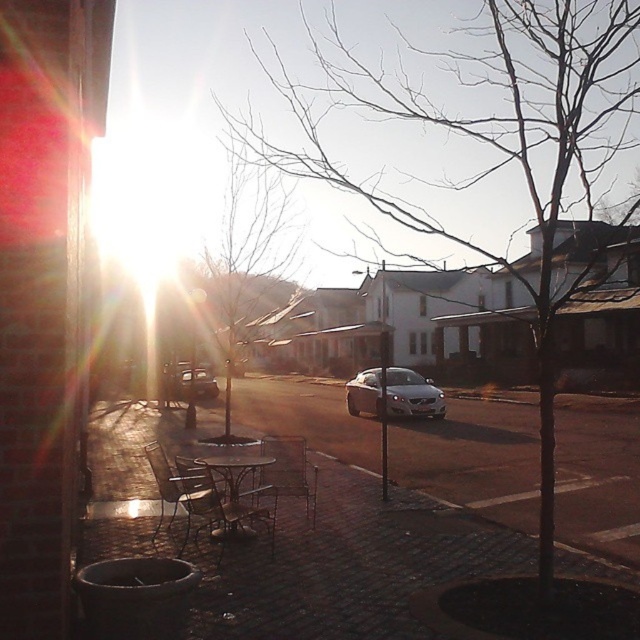
Question: Does metallic silver chair at lower left have a larger size compared to metallic silver sedan at center?

Choices:
 (A) yes
 (B) no

Answer: (B)

Question: Estimate the real-world distances between objects in this image. Which object is farther from the metallic silver sedan at center?

Choices:
 (A) metallic silver table at center
 (B) metallic silver chair at center
 (C) metallic silver chair at lower left
 (D) satin silver sedan at center

Answer: (B)

Question: Does satin silver sedan at center have a smaller size compared to metallic silver table at center?

Choices:
 (A) yes
 (B) no

Answer: (B)

Question: Estimate the real-world distances between objects in this image. Which object is closer to the metallic silver chair at center?

Choices:
 (A) metallic silver table at center
 (B) metallic silver chair at lower left
 (C) metallic silver sedan at center
 (D) satin silver sedan at center

Answer: (A)

Question: Is metallic silver chair at lower left above metallic silver chair at center?

Choices:
 (A) yes
 (B) no

Answer: (A)

Question: Which point appears closest to the camera in this image?

Choices:
 (A) (259, 492)
 (B) (362, 408)

Answer: (A)